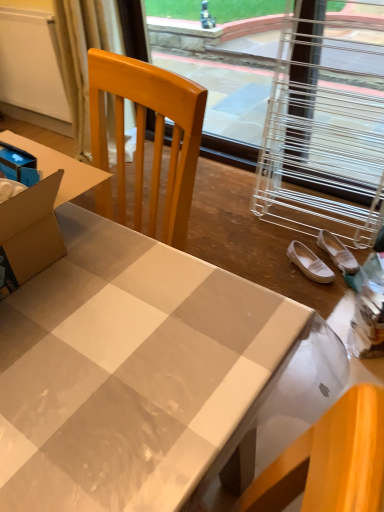
The width and height of the screenshot is (384, 512). Describe the element at coordinates (82, 55) in the screenshot. I see `beige fabric curtain at upper left` at that location.

The width and height of the screenshot is (384, 512). What are the coordinates of `metallic wire at upper right` in the screenshot? It's located at (221, 72).

How different are the orientations of metallic wire at upper right and white glossy desk at center in degrees?

There is a 87.1-degree angle between the facing directions of metallic wire at upper right and white glossy desk at center.

Is metallic wire at upper right facing away from white glossy desk at center?

No.

Is metallic wire at upper right far away from white glossy desk at center?

metallic wire at upper right is positioned a significant distance from white glossy desk at center.

Which object is wider, metallic wire at upper right or white glossy desk at center?

white glossy desk at center.

Considering the relative sizes of beige fabric curtain at upper left and metallic wire at upper right in the image provided, is beige fabric curtain at upper left shorter than metallic wire at upper right?

Yes, beige fabric curtain at upper left is shorter than metallic wire at upper right.

Is beige fabric curtain at upper left turned away from metallic wire at upper right?

beige fabric curtain at upper left is not turned away from metallic wire at upper right.

Is beige fabric curtain at upper left positioned behind metallic wire at upper right?

Yes, beige fabric curtain at upper left is further from the camera.

From a real-world perspective, who is located lower, beige fabric curtain at upper left or metallic wire at upper right?

From a 3D spatial view, metallic wire at upper right is below.

Is white fabric shoe at lower right, which ranks as the 1th footwear in right-to-left order, not inside metallic wire at upper right?

Absolutely, white fabric shoe at lower right, which ranks as the 1th footwear in right-to-left order, is external to metallic wire at upper right.

Is white fabric shoe at lower right, which ranks as the 1th footwear in right-to-left order, oriented towards metallic wire at upper right?

No, white fabric shoe at lower right, which ranks as the 1th footwear in right-to-left order, is not aimed at metallic wire at upper right.

Does white fabric shoe at lower right, marked as the second footwear in a left-to-right arrangement, have a greater height compared to metallic wire at upper right?

In fact, white fabric shoe at lower right, marked as the second footwear in a left-to-right arrangement, may be shorter than metallic wire at upper right.

Is the position of white fabric shoe at lower right, which ranks as the 1th footwear in right-to-left order, less distant than that of metallic wire at upper right?

No, white fabric shoe at lower right, which ranks as the 1th footwear in right-to-left order, is further to the viewer.

In the scene shown: Is white glossy desk at center looking in the opposite direction of metallic wire at upper right?

That's not correct — white glossy desk at center is not looking away from metallic wire at upper right.

Are white glossy desk at center and metallic wire at upper right far apart?

Yes, white glossy desk at center and metallic wire at upper right are quite far apart.

Which of these two, white glossy desk at center or metallic wire at upper right, is thinner?

With smaller width is metallic wire at upper right.

Is metallic wire at upper right inside white glossy desk at center?

No.

Based on the photo, is white fabric shoe at lower right, marked as the second footwear in a left-to-right arrangement, spatially inside beige fabric curtain at upper left, or outside of it?

white fabric shoe at lower right, marked as the second footwear in a left-to-right arrangement, is not inside beige fabric curtain at upper left, it's outside.

Which point is more forward, (339, 246) or (77, 7)?

The point (339, 246) is more forward.

Considering the relative sizes of white fabric shoe at lower right, which ranks as the 1th footwear in right-to-left order, and beige fabric curtain at upper left in the image provided, is white fabric shoe at lower right, which ranks as the 1th footwear in right-to-left order, thinner than beige fabric curtain at upper left?

Correct, the width of white fabric shoe at lower right, which ranks as the 1th footwear in right-to-left order, is less than that of beige fabric curtain at upper left.

I want to click on curtain that is behind the white fabric shoe at lower right, marked as the second footwear in a left-to-right arrangement, so click(x=82, y=55).

Which object is further away from the camera taking this photo, beige fabric curtain at upper left or white suede shoes at lower right, marked as the 1th footwear in a left-to-right arrangement?

beige fabric curtain at upper left.

Is beige fabric curtain at upper left bigger or smaller than white suede shoes at lower right, marked as the 1th footwear in a left-to-right arrangement?

Considering their sizes, beige fabric curtain at upper left takes up more space than white suede shoes at lower right, marked as the 1th footwear in a left-to-right arrangement.

Is white suede shoes at lower right, marked as the 1th footwear in a left-to-right arrangement, located within beige fabric curtain at upper left?

No, white suede shoes at lower right, marked as the 1th footwear in a left-to-right arrangement, is not a part of beige fabric curtain at upper left.

Could you tell me if beige fabric curtain at upper left is turned towards white suede shoes at lower right, marked as the 1th footwear in a left-to-right arrangement?

No, beige fabric curtain at upper left is not turned towards white suede shoes at lower right, marked as the 1th footwear in a left-to-right arrangement.

Does white suede shoes at lower right, which is counted as the 2th footwear, starting from the right, turn towards white glossy desk at center?

No.

Considering the relative positions of white suede shoes at lower right, marked as the 1th footwear in a left-to-right arrangement, and white glossy desk at center in the image provided, is white suede shoes at lower right, marked as the 1th footwear in a left-to-right arrangement, behind white glossy desk at center?

Yes, white suede shoes at lower right, marked as the 1th footwear in a left-to-right arrangement, is behind white glossy desk at center.

The height and width of the screenshot is (512, 384). Identify the location of desk in front of the white suede shoes at lower right, marked as the 1th footwear in a left-to-right arrangement. (143, 372).

In order to click on window screen behind the white glossy desk at center in this screenshot , I will do `click(221, 72)`.

Image resolution: width=384 pixels, height=512 pixels. What are the coordinates of `window screen that is below the beige fabric curtain at upper left (from the image's perspective)` in the screenshot? It's located at (221, 72).

When comparing their distances from white suede shoes at lower right, marked as the 1th footwear in a left-to-right arrangement, does white fabric shoe at lower right, which ranks as the 1th footwear in right-to-left order, or metallic wire at upper right seem further?

metallic wire at upper right.

Which object lies nearer to the anchor point white glossy desk at center, beige fabric curtain at upper left or metallic wire at upper right?

beige fabric curtain at upper left.

In the scene shown: When comparing their distances from white glossy desk at center, does white fabric shoe at lower right, marked as the second footwear in a left-to-right arrangement, or white suede shoes at lower right, which is counted as the 2th footwear, starting from the right, seem further?

The object further to white glossy desk at center is white fabric shoe at lower right, marked as the second footwear in a left-to-right arrangement.

Considering their positions, is white glossy desk at center positioned further to white suede shoes at lower right, which is counted as the 2th footwear, starting from the right, than beige fabric curtain at upper left?

beige fabric curtain at upper left.

Estimate the real-world distances between objects in this image. Which object is closer to white fabric shoe at lower right, which ranks as the 1th footwear in right-to-left order, white glossy desk at center or white suede shoes at lower right, marked as the 1th footwear in a left-to-right arrangement?

The object closer to white fabric shoe at lower right, which ranks as the 1th footwear in right-to-left order, is white suede shoes at lower right, marked as the 1th footwear in a left-to-right arrangement.

Considering their positions, is white glossy desk at center positioned closer to beige fabric curtain at upper left than white suede shoes at lower right, which is counted as the 2th footwear, starting from the right?

Based on the image, white suede shoes at lower right, which is counted as the 2th footwear, starting from the right, appears to be nearer to beige fabric curtain at upper left.

Based on the photo, looking at the image, which one is located further to white glossy desk at center, white suede shoes at lower right, which is counted as the 2th footwear, starting from the right, or metallic wire at upper right?

metallic wire at upper right is further to white glossy desk at center.

Based on their spatial positions, is white suede shoes at lower right, which is counted as the 2th footwear, starting from the right, or metallic wire at upper right closer to beige fabric curtain at upper left?

metallic wire at upper right lies closer to beige fabric curtain at upper left than the other object.

Where is `footwear situated between beige fabric curtain at upper left and white fabric shoe at lower right, which ranks as the 1th footwear in right-to-left order, from left to right`? footwear situated between beige fabric curtain at upper left and white fabric shoe at lower right, which ranks as the 1th footwear in right-to-left order, from left to right is located at coordinates (309, 263).

I want to click on window screen located between white glossy desk at center and beige fabric curtain at upper left in the depth direction, so click(x=221, y=72).

Find the location of a particular element. window screen positioned between white glossy desk at center and white fabric shoe at lower right, which ranks as the 1th footwear in right-to-left order, from near to far is located at coordinates (221, 72).

Where is `footwear positioned between white glossy desk at center and metallic wire at upper right from near to far`? The width and height of the screenshot is (384, 512). footwear positioned between white glossy desk at center and metallic wire at upper right from near to far is located at coordinates (309, 263).